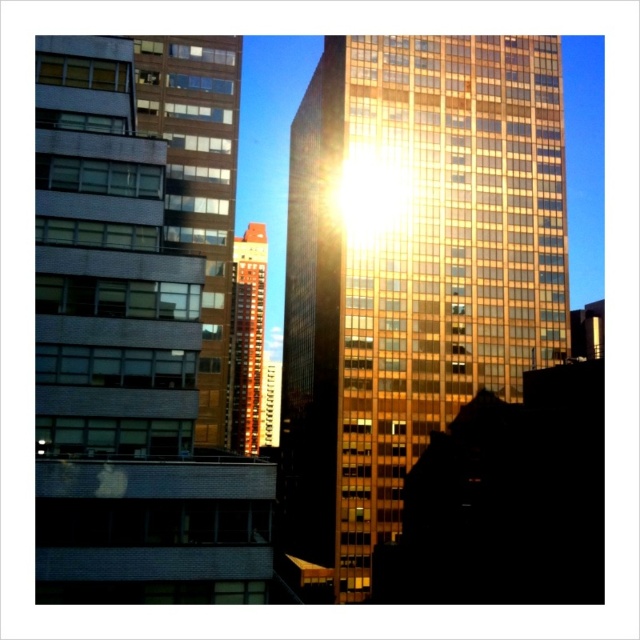
You are standing in the urban scene and want to take a photo. You notice two points marked in the image. The first point is at coordinate point [460,148] and the second is at point [243,364]. Which point will appear larger in your camera view?

Point [460,148] is closer to the camera than point [243,364], so it will appear larger in the camera view.

In the urban scene, you notice two buildings. The gold reflective glass building at center and the brown glass building at upper left. Which building is positioned higher in the image?

The gold reflective glass building at center is located above the brown glass building at upper left, so it is positioned higher in the image.